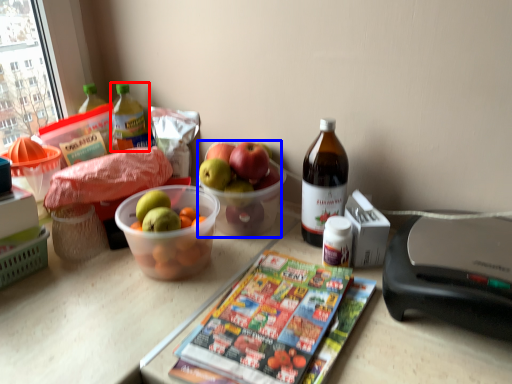
Question: Which of the following is the closest to the observer, bottle (highlighted by a red box) or grapefruit (highlighted by a blue box)?

Choices:
 (A) bottle
 (B) grapefruit

Answer: (B)